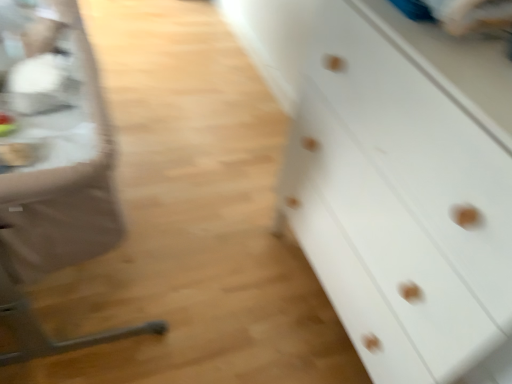
You are a GUI agent. You are given a task and a screenshot of the screen. Output one action in this format:
    pyautogui.click(x=<x>, y=<y>)
    Task: Click on the free location to the left of white matte chest of drawers at right
    
    Given the screenshot: What is the action you would take?
    pyautogui.click(x=220, y=263)